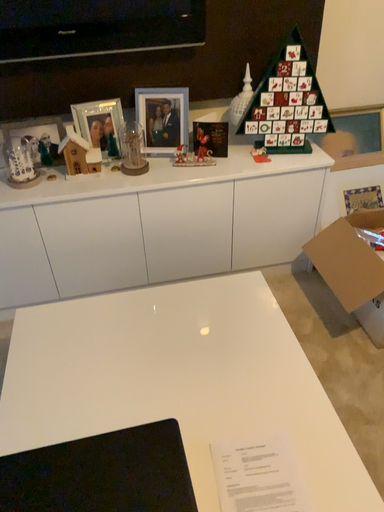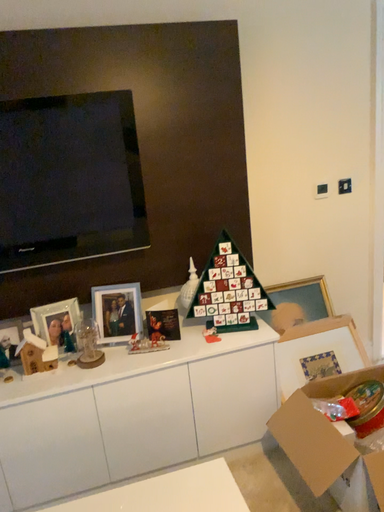
Question: Which way did the camera rotate in the video?

Choices:
 (A) rotated upward
 (B) rotated downward

Answer: (A)